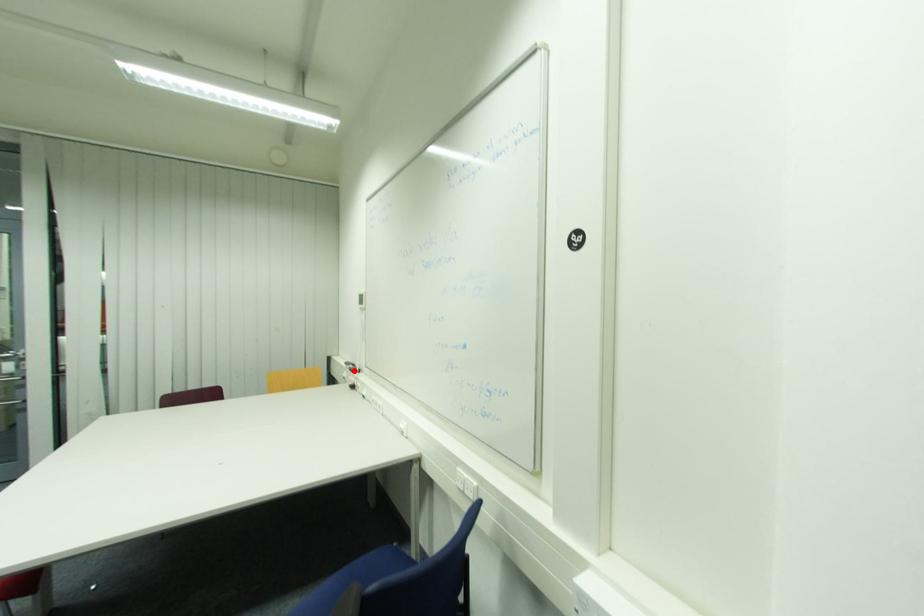
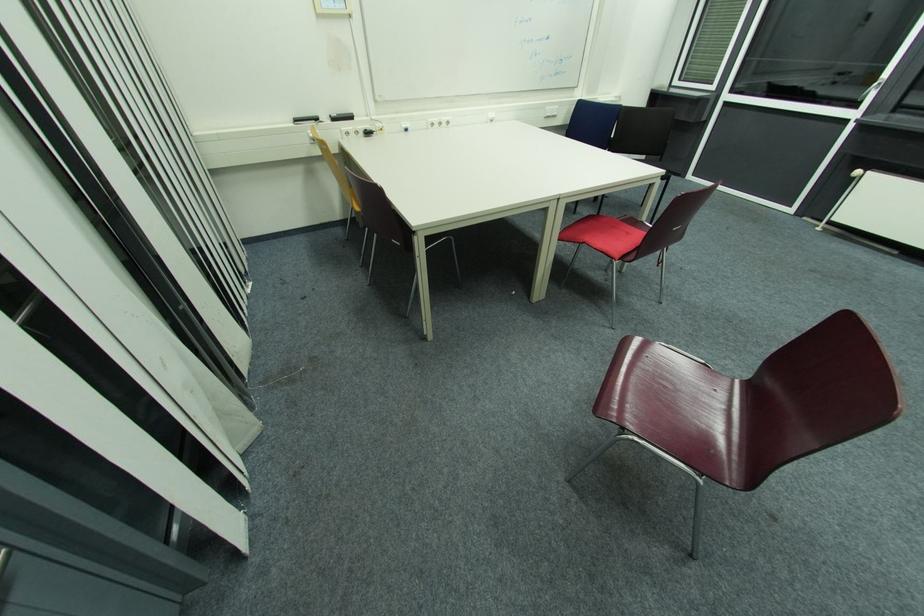
Where in the second image is the point corresponding to the highlighted location from the first image?

(337, 121)